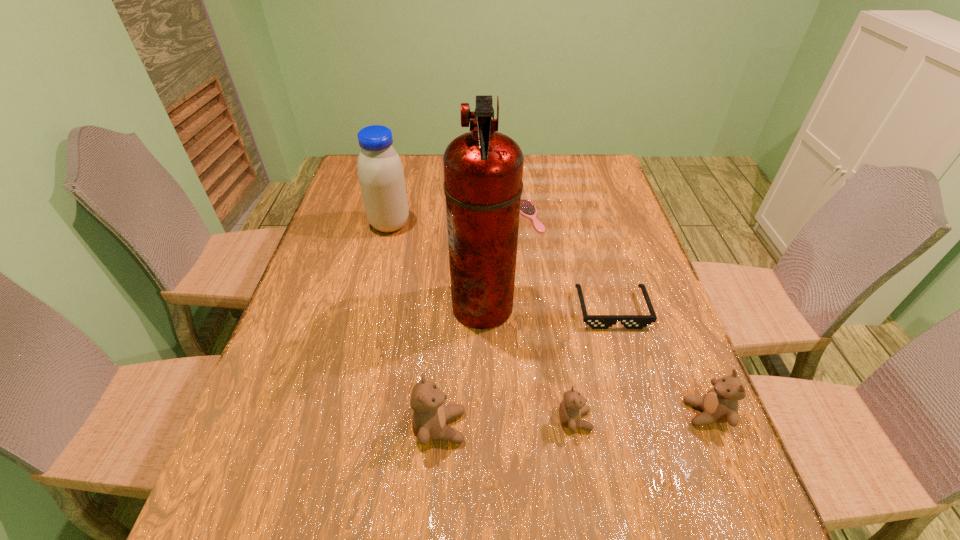
At what (x,y) coordinates should I click in order to perform the action: click on vacant space at the right edge of the desktop. Please return your answer as a coordinate pair (x, y). The width and height of the screenshot is (960, 540). Looking at the image, I should click on (600, 268).

This screenshot has width=960, height=540. In order to click on free region at the near left corner in this screenshot , I will do click(316, 458).

You are a GUI agent. You are given a task and a screenshot of the screen. Output one action in this format:
    pyautogui.click(x=<x>, y=<y>)
    Task: Click on the blank area at the far right corner
    
    Given the screenshot: What is the action you would take?
    pyautogui.click(x=593, y=185)

Locate an element on the screen. The height and width of the screenshot is (540, 960). empty space between the tallest teddy bear and the second shortest object is located at coordinates 526,368.

Find the location of a particular element. free area in between the tallest teddy bear and the sixth object from left to right is located at coordinates (526, 368).

At what (x,y) coordinates should I click in order to perform the action: click on free space between the rightmost object and the leftmost object. Please return your answer as a coordinate pair (x, y). The image size is (960, 540). Looking at the image, I should click on (548, 319).

Image resolution: width=960 pixels, height=540 pixels. I want to click on free space between the shortest object and the shortest teddy bear, so click(x=552, y=318).

The width and height of the screenshot is (960, 540). I want to click on vacant region between the shortest object and the second teddy bear from left to right, so click(x=552, y=318).

Locate an element on the screen. This screenshot has width=960, height=540. vacant area that lies between the sunglasses and the tallest object is located at coordinates (547, 308).

Identify the location of vacant area that lies between the shortest object and the rightmost teddy bear. click(x=618, y=315).